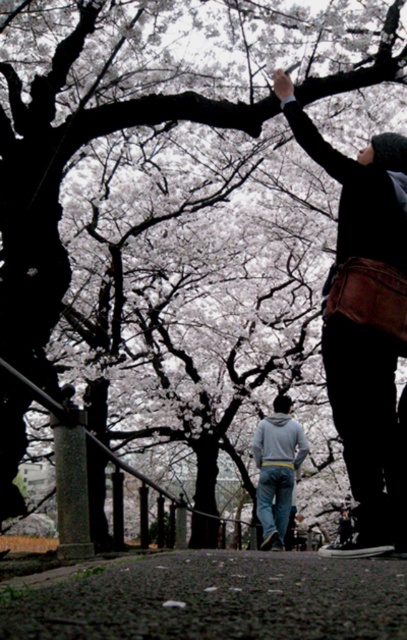
Who is positioned more to the right, dark asphalt path at lower center or denim jeans at center?

denim jeans at center

From the picture: Does dark asphalt path at lower center appear on the left side of denim jeans at center?

Correct, you'll find dark asphalt path at lower center to the left of denim jeans at center.

Does point (383, 564) come behind point (286, 506)?

No, (383, 564) is closer to viewer.

Where is `dark asphalt path at lower center`? dark asphalt path at lower center is located at coordinates (209, 596).

Is point (345, 348) more distant than point (273, 406)?

No, (345, 348) is closer to viewer.

Does dark brown leather bag at upper right have a greater width compared to denim jeans at center?

In fact, dark brown leather bag at upper right might be narrower than denim jeans at center.

Between point (389, 209) and point (264, 518), which one is positioned behind?

Positioned behind is point (264, 518).

You are a GUI agent. You are given a task and a screenshot of the screen. Output one action in this format:
    pyautogui.click(x=<x>, y=<y>)
    Task: Click on the dark brown leather bag at upper right
    This screenshot has height=640, width=407.
    Given the screenshot: What is the action you would take?
    pyautogui.click(x=365, y=323)

Which is in front, point (201, 582) or point (398, 348)?

Point (201, 582)

Describe the element at coordinates (209, 596) in the screenshot. I see `dark asphalt path at lower center` at that location.

Identify the location of dark asphalt path at lower center. [209, 596].